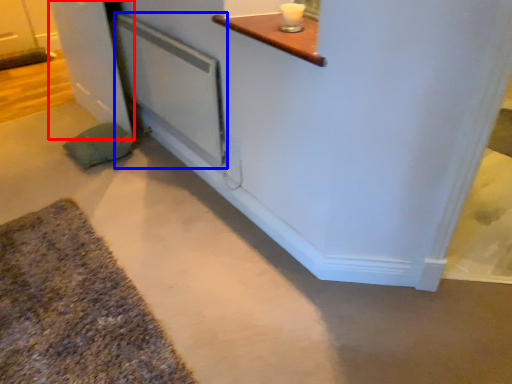
Question: Which object is closer to the camera taking this photo, door (highlighted by a red box) or screen door (highlighted by a blue box)?

Choices:
 (A) door
 (B) screen door

Answer: (B)